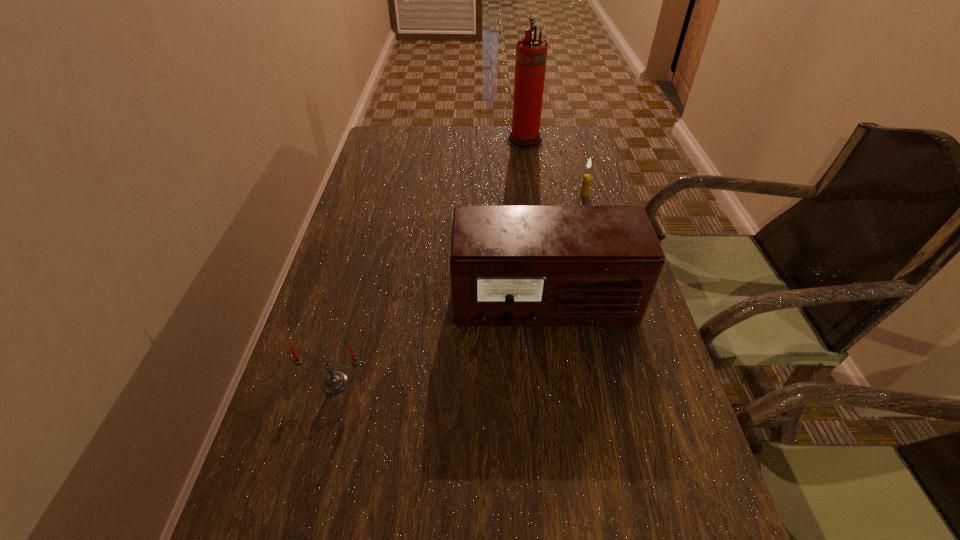
In the image, there is a desktop. What are the coordinates of `vacant area at the far edge` in the screenshot? It's located at (485, 157).

You are a GUI agent. You are given a task and a screenshot of the screen. Output one action in this format:
    pyautogui.click(x=<x>, y=<y>)
    Task: Click on the vacant space at the left edge of the desktop
    This screenshot has width=960, height=540.
    Given the screenshot: What is the action you would take?
    pyautogui.click(x=274, y=479)

The image size is (960, 540). I want to click on free space at the right edge of the desktop, so click(674, 458).

In the image, there is a desktop. Identify the location of vacant space at the far right corner. (552, 147).

Locate an element on the screen. Image resolution: width=960 pixels, height=540 pixels. empty location between the farthest object and the right candle is located at coordinates (555, 168).

Identify the location of the third closest object relative to the radio receiver. (531, 53).

Locate an element on the screen. the closest object to the second farthest object is located at coordinates (531, 53).

Find the location of a particular element. This screenshot has width=960, height=540. vacant area in the image that satisfies the following two spatial constraints: 1. at the discharge end of the farthest object; 2. on the front-facing side of the nearer candle is located at coordinates (561, 383).

Find the location of a particular element. The image size is (960, 540). vacant point that satisfies the following two spatial constraints: 1. at the discharge end of the tallest object; 2. on the front-facing side of the third farthest object is located at coordinates (549, 303).

The image size is (960, 540). Find the location of `vacant space that satisfies the following two spatial constraints: 1. at the discharge end of the farthest object; 2. on the front-facing side of the third shortest object`. vacant space that satisfies the following two spatial constraints: 1. at the discharge end of the farthest object; 2. on the front-facing side of the third shortest object is located at coordinates (549, 303).